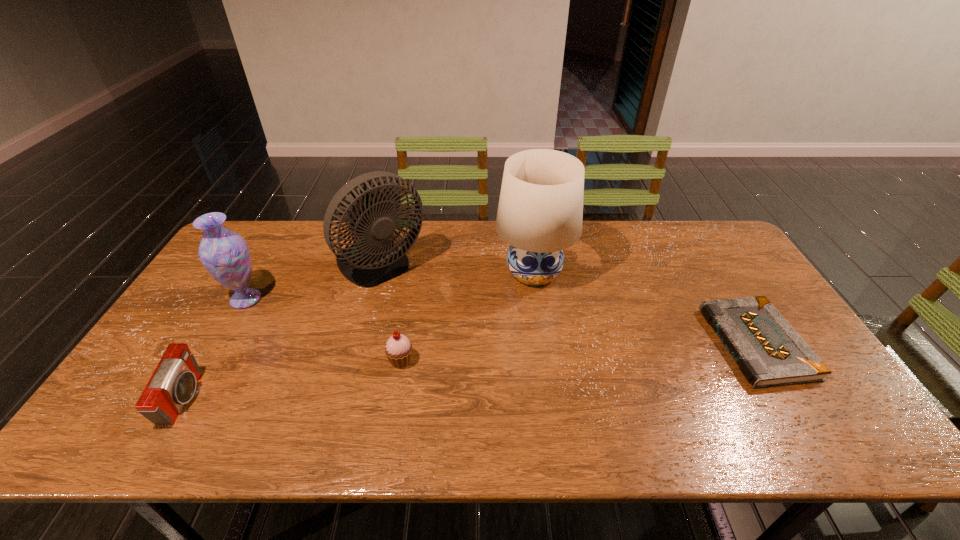
Find the location of a particular element. The height and width of the screenshot is (540, 960). free space located 0.390m on the front-facing side of the camera is located at coordinates (359, 399).

This screenshot has height=540, width=960. In order to click on vacant space located 0.310m on the left of the cupcake in this screenshot , I will do `click(268, 361)`.

You are a GUI agent. You are given a task and a screenshot of the screen. Output one action in this format:
    pyautogui.click(x=<x>, y=<y>)
    Task: Click on the blank space located on the back of the notebook
    This screenshot has width=960, height=540.
    Given the screenshot: What is the action you would take?
    [x=713, y=274]

Identify the location of lampshade that is at the far edge. [x=540, y=213].

Locate an element on the screen. This screenshot has width=960, height=540. fan located at the far edge is located at coordinates (374, 259).

Locate an element on the screen. object that is at the near edge is located at coordinates (173, 384).

Where is `vase that is at the left edge`? The width and height of the screenshot is (960, 540). vase that is at the left edge is located at coordinates (225, 254).

Where is `camera present at the left edge`? This screenshot has height=540, width=960. camera present at the left edge is located at coordinates (x=173, y=384).

Where is `object present at the right edge`? object present at the right edge is located at coordinates [x=769, y=352].

Locate an element on the screen. The image size is (960, 540). object present at the near left corner is located at coordinates [173, 384].